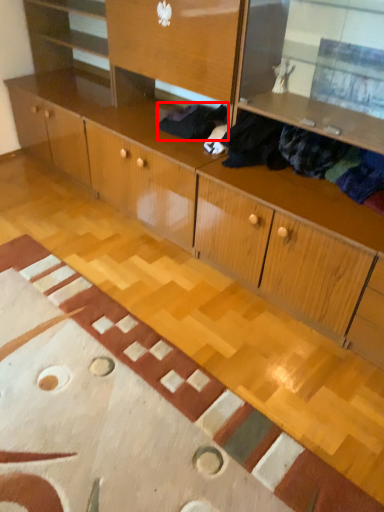
Question: From the image's perspective, what is the correct spatial positioning of clothing (annotated by the red box) in reference to clothing?

Choices:
 (A) below
 (B) above

Answer: (B)